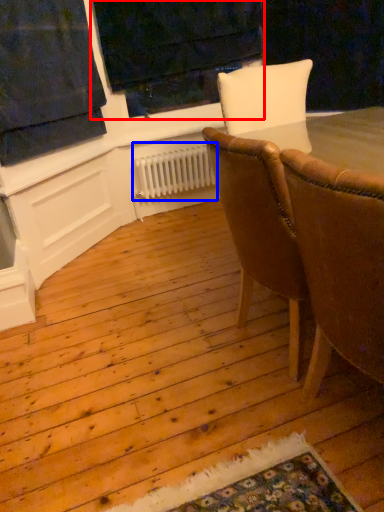
Question: Among these objects, which one is farthest to the camera, window frame (highlighted by a red box) or radiator (highlighted by a blue box)?

Choices:
 (A) window frame
 (B) radiator

Answer: (B)